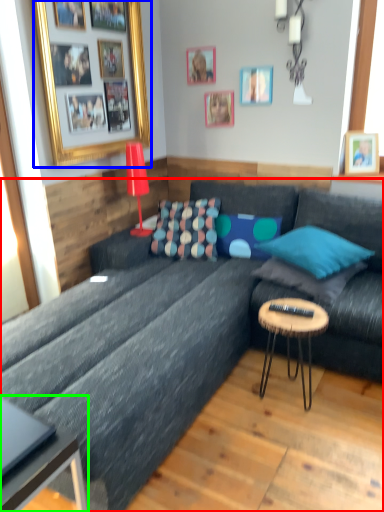
Question: Considering the real-world distances, which object is farthest from studio couch (highlighted by a red box)? picture frame (highlighted by a blue box) or coffee table (highlighted by a green box)?

Choices:
 (A) picture frame
 (B) coffee table

Answer: (A)